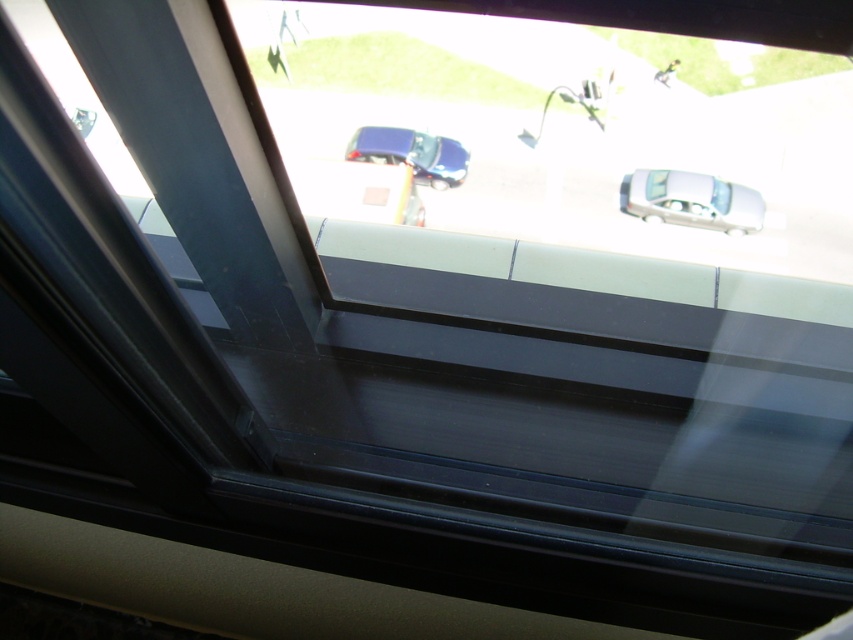
You are a passenger in a car and want to know which car is closer to your window. You see the white glossy car at center and the shiny blue car at center outside. Based on their positions, which one is nearer to your window?

The white glossy car at center is in front of the shiny blue car at center, so the white glossy car at center is closer to your window.

You are a driver trying to parallel park your car. You see a white glossy car at center and a shiny blue car at center. Which car should you avoid hitting when pulling into the parking spot between them?

You should avoid hitting the shiny blue car at center because the white glossy car at center is to the right of it, so the blue car is on the left side of the white car.

You are a driver who wants to exit the parking lot. You see a white glossy car at center and a shiny blue car at center. Which car is blocking your path to the parking lot exit?

The shiny blue car at center is blocking your path because the white glossy car at center is positioned under it, indicating it is parked above or in front of the white car, possibly blocking the exit route.